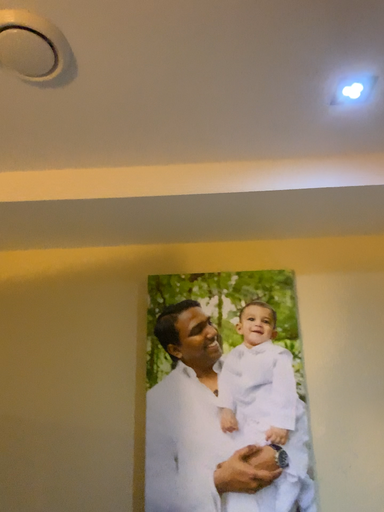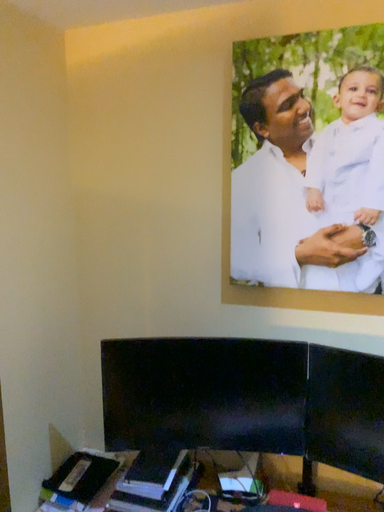
Question: How did the camera likely rotate when shooting the video?

Choices:
 (A) rotated upward
 (B) rotated downward

Answer: (B)